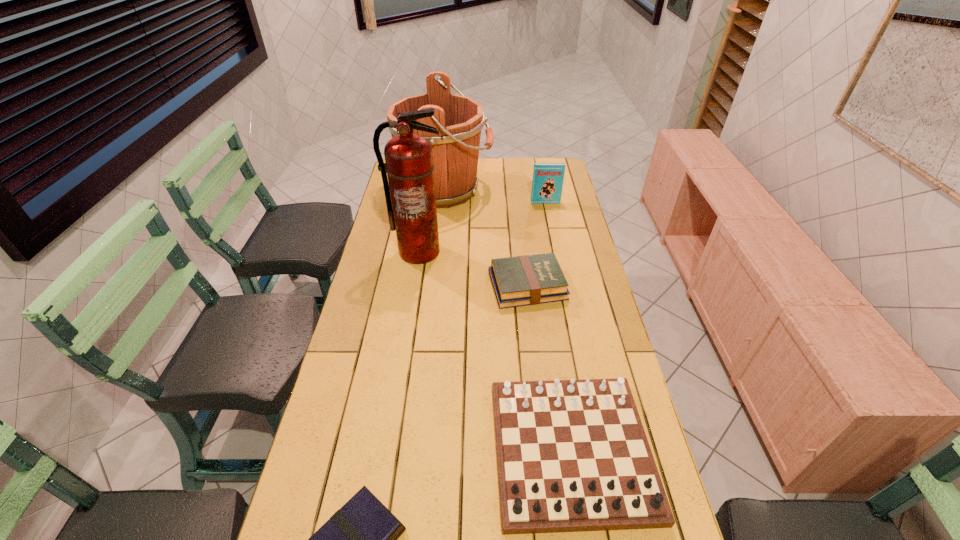
The width and height of the screenshot is (960, 540). What are the coordinates of `free area in between the tallest object and the second farthest book` in the screenshot? It's located at (473, 269).

Image resolution: width=960 pixels, height=540 pixels. Find the location of `empty location between the tallest book and the bucket`. empty location between the tallest book and the bucket is located at coordinates (495, 196).

The image size is (960, 540). I want to click on empty location between the tallest object and the farthest book, so click(482, 227).

Locate an element on the screen. Image resolution: width=960 pixels, height=540 pixels. vacant area that lies between the tallest object and the third tallest object is located at coordinates (482, 227).

You are a GUI agent. You are given a task and a screenshot of the screen. Output one action in this format:
    pyautogui.click(x=<x>, y=<y>)
    Task: Click on the vacant point located between the tallest object and the farthest book
    The height and width of the screenshot is (540, 960).
    Given the screenshot: What is the action you would take?
    pyautogui.click(x=482, y=227)

This screenshot has width=960, height=540. In order to click on free space between the third tallest object and the second tallest book in this screenshot , I will do `click(537, 244)`.

Identify which object is the fifth nearest to the bucket. Please provide its 2D coordinates. Your answer should be formatted as a tuple, i.e. [(x, y)], where the tuple contains the x and y coordinates of a point satisfying the conditions above.

[(361, 539)]

You are a GUI agent. You are given a task and a screenshot of the screen. Output one action in this format:
    pyautogui.click(x=<x>, y=<y>)
    Task: Click on the object that can be found as the fifth closest to the tallest object
    The width and height of the screenshot is (960, 540).
    Given the screenshot: What is the action you would take?
    [x=361, y=539]

Image resolution: width=960 pixels, height=540 pixels. I want to click on book that stands as the second closest to the shortest book, so coord(547,184).

The height and width of the screenshot is (540, 960). Identify the location of book that can be found as the second closest to the farthest book. 361,539.